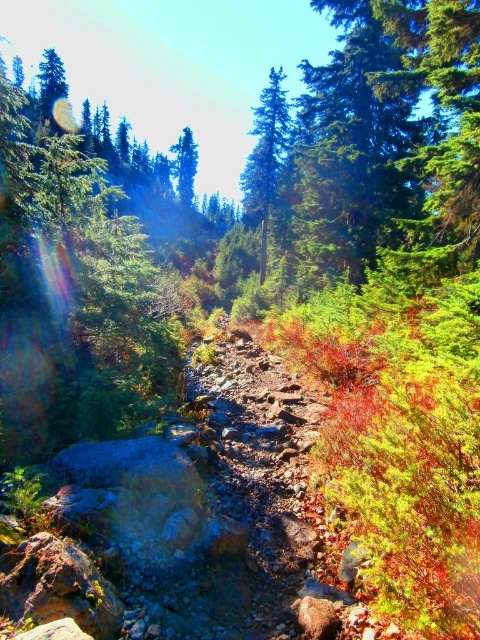
Question: Which object is closer to the camera taking this photo?

Choices:
 (A) green matte tree at upper center
 (B) green matte tree at center

Answer: (B)

Question: Which point is closer to the camera?

Choices:
 (A) (269, 81)
 (B) (187, 168)

Answer: (A)

Question: Can you confirm if green matte tree at center is positioned to the right of green matte tree at upper center?

Choices:
 (A) yes
 (B) no

Answer: (A)

Question: Does green matte tree at center have a larger size compared to green matte tree at upper center?

Choices:
 (A) no
 (B) yes

Answer: (A)

Question: Does green matte tree at center appear on the right side of green matte tree at upper center?

Choices:
 (A) no
 (B) yes

Answer: (B)

Question: Which point appears closest to the camera in this image?

Choices:
 (A) (178, 177)
 (B) (262, 92)

Answer: (B)